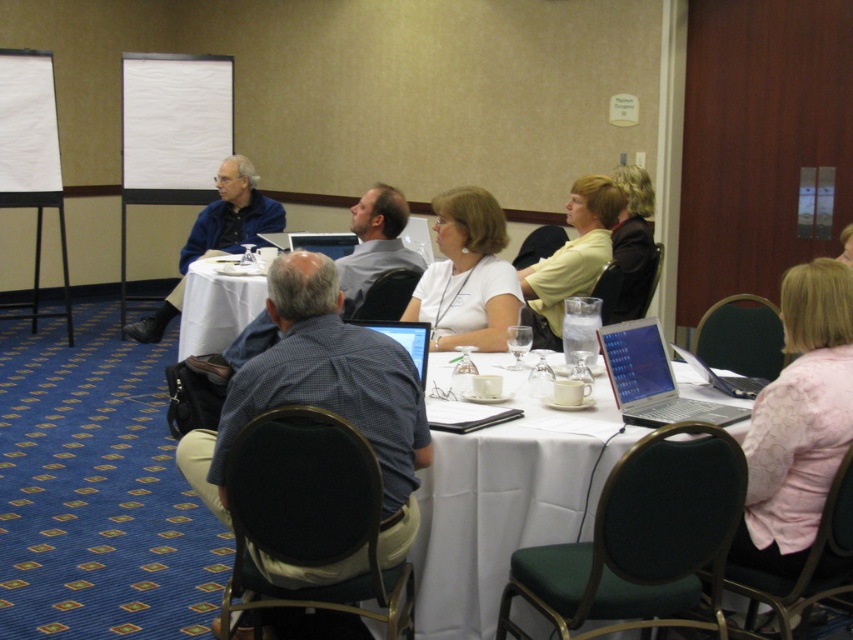
Question: Can you confirm if white matte shirt at center is wider than dark brown leather jacket at upper right?

Choices:
 (A) no
 (B) yes

Answer: (B)

Question: Is white matte shirt at center behind matte black laptop at center?

Choices:
 (A) no
 (B) yes

Answer: (B)

Question: Which object appears farthest from the camera in this image?

Choices:
 (A) dark brown leather jacket at upper right
 (B) white matte shirt at center

Answer: (A)

Question: Which point is farther from the camera taking this photo?

Choices:
 (A) (628, 364)
 (B) (216, 177)
 (C) (521, 608)
 (D) (445, 326)

Answer: (B)

Question: Is blue cotton shirt at upper center to the right of dark brown leather jacket at upper right from the viewer's perspective?

Choices:
 (A) no
 (B) yes

Answer: (A)

Question: Which object appears farthest from the camera in this image?

Choices:
 (A) white cloth at center
 (B) silver metallic laptop at center

Answer: (B)